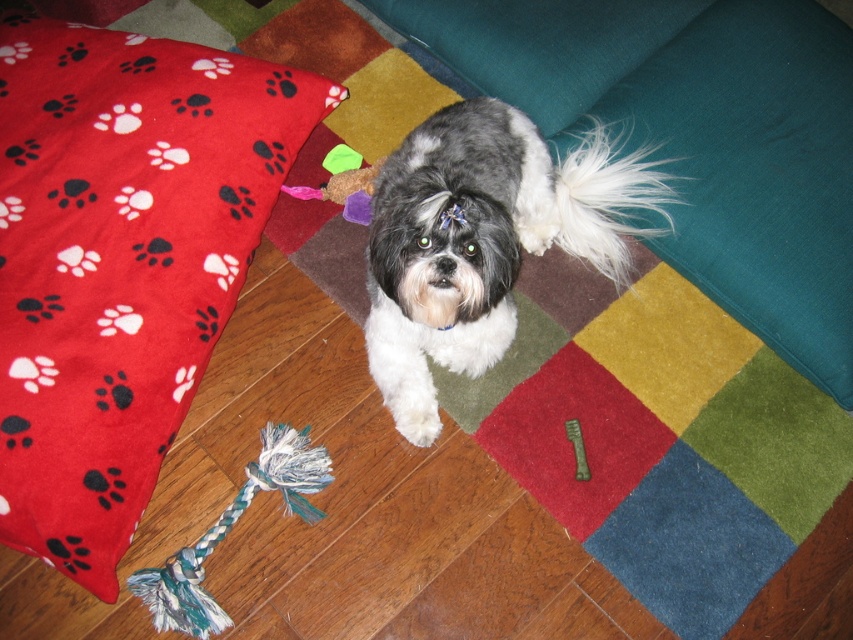
Looking at this image, you are a dog groomer holding a 6 inch long comb. You need to groom the black and white fur at center and the white fluffy tail at upper center. Can you reach both areas with your comb without moving it?

The distance between the black and white fur at center and the white fluffy tail at upper center is 5.95 inches, so the 6 inch comb can reach both areas without needing to move it.

You are a photographer trying to capture the perfect shot of the black and white fur at center and the white fluffy tail at upper center. Which object should you focus on first if you want to start from the left side of the image?

The black and white fur at center should be focused on first because it is positioned to the left of the white fluffy tail at upper center.